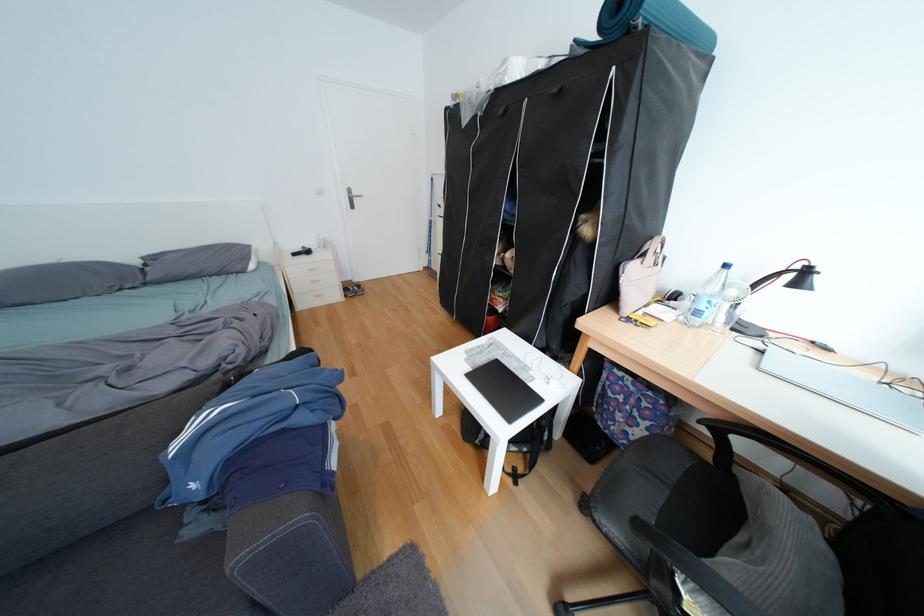
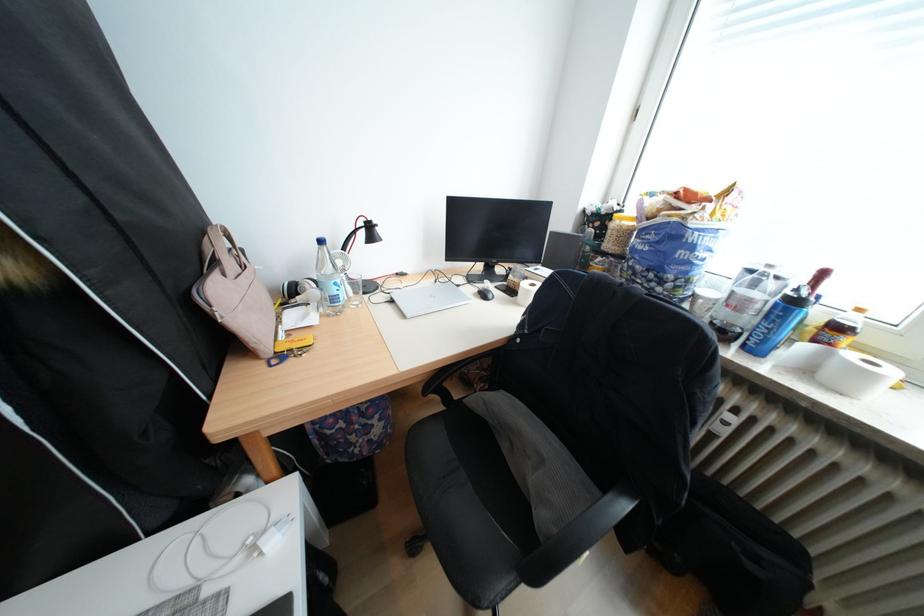
The point at [774,353] is marked in the first image. Where is the corresponding point in the second image?

(405, 302)